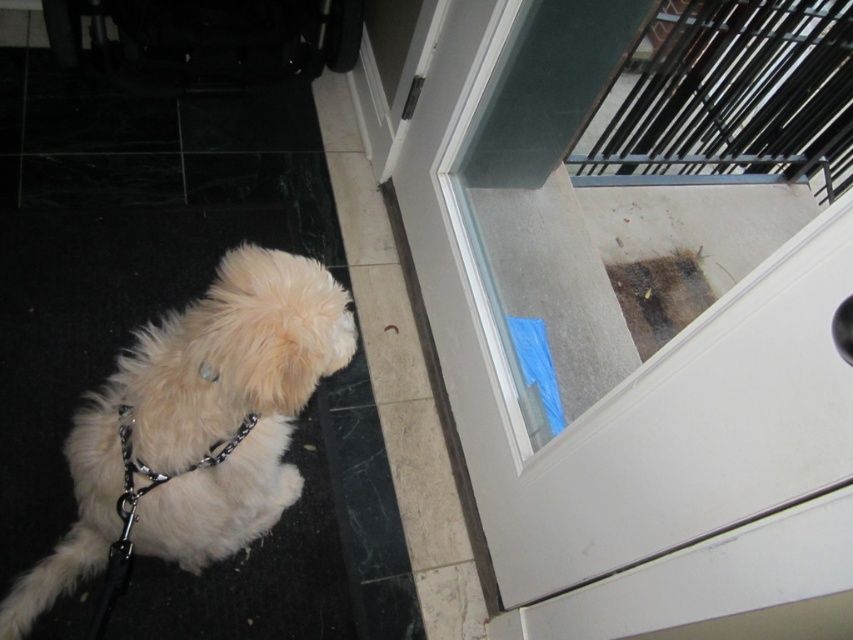
Who is positioned more to the left, transparent glass screen door at upper right or white fluffy dog at lower left?

white fluffy dog at lower left

Is transparent glass screen door at upper right taller than white fluffy dog at lower left?

Yes.

Where is `transparent glass screen door at upper right`? Image resolution: width=853 pixels, height=640 pixels. transparent glass screen door at upper right is located at coordinates (645, 307).